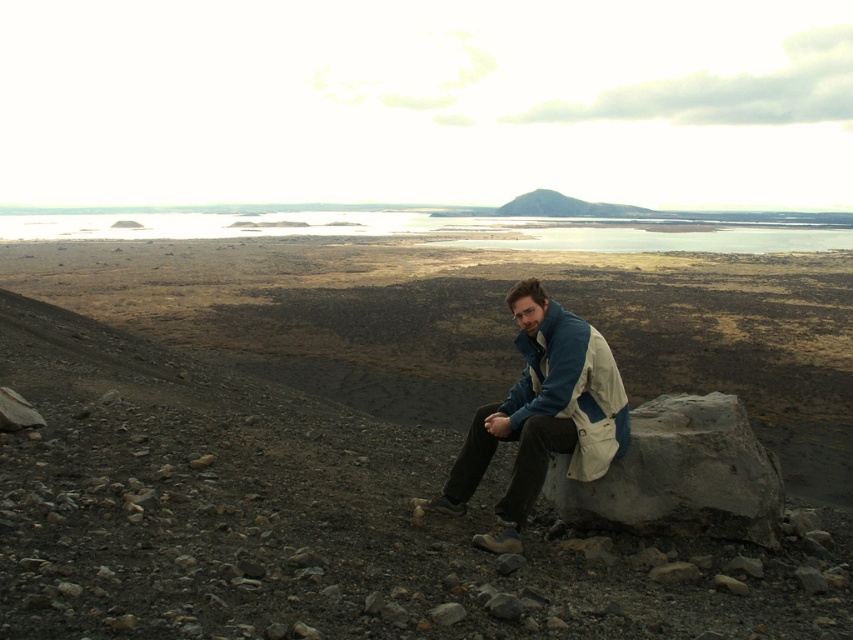
You are a hiker trying to navigate through this rocky terrain. You need to move from your current position near the gray rough rock at lower right to the blue fabric jacket at center. Which direction should you move to reach the jacket?

The gray rough rock at lower right is positioned on the right side of the blue fabric jacket at center, so you should move to the left to reach the jacket.

You are planning to place a small backpack on the ground next to the gray rough rock at lower right and the blue fabric jacket at center. Which object should you place the backpack next to if you want it to be near the larger object?

You should place the backpack next to the gray rough rock at lower right because its width is larger than the blue fabric jacket at center.